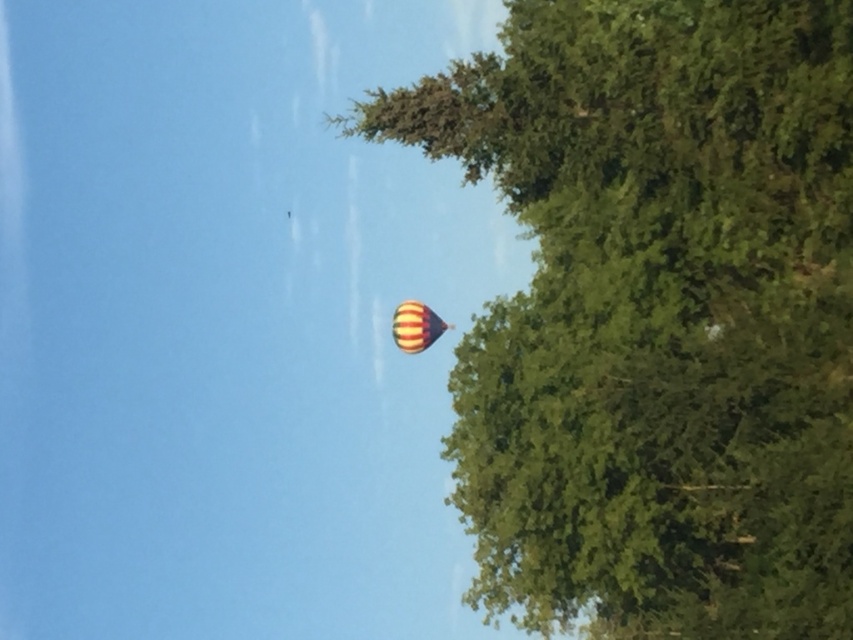
You are an observer looking at the image. You notice the green leafy tree at upper right and the striped fabric balloon at upper center. Which object appears larger in the image?

The green leafy tree at upper right appears larger than the striped fabric balloon at upper center in the image.

You are standing in a field and looking up at the green leafy tree at upper right and the striped fabric balloon at upper center. Which object is nearer to your eyes?

The green leafy tree at upper right is closer to the viewer than the striped fabric balloon at upper center, so the green leafy tree at upper right is nearer to your eyes.

You are standing in a field and looking up at the sky. You see a green leafy tree at upper right and a striped fabric balloon at upper center. Which object is positioned higher in the sky?

The green leafy tree at upper right is located above the striped fabric balloon at upper center, so it is positioned higher in the sky.